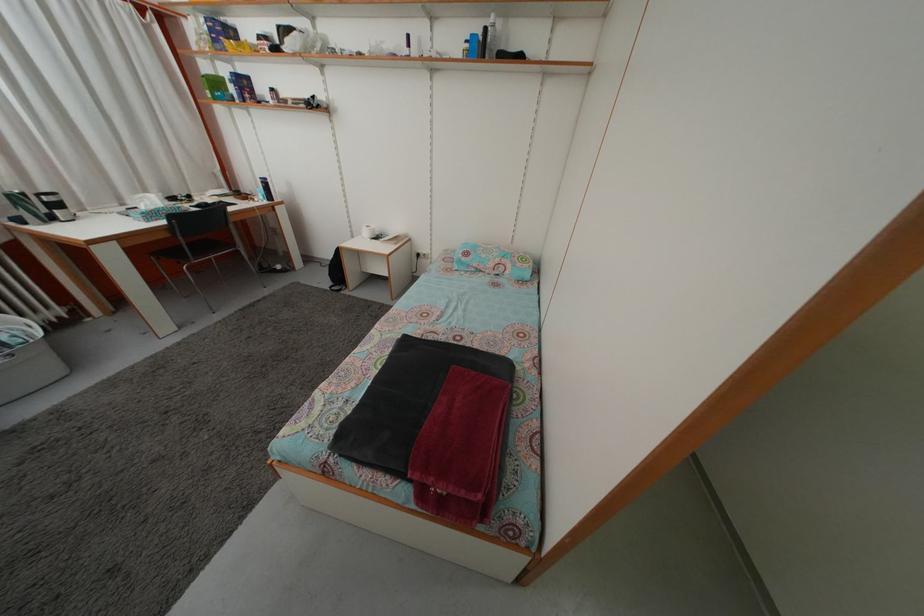
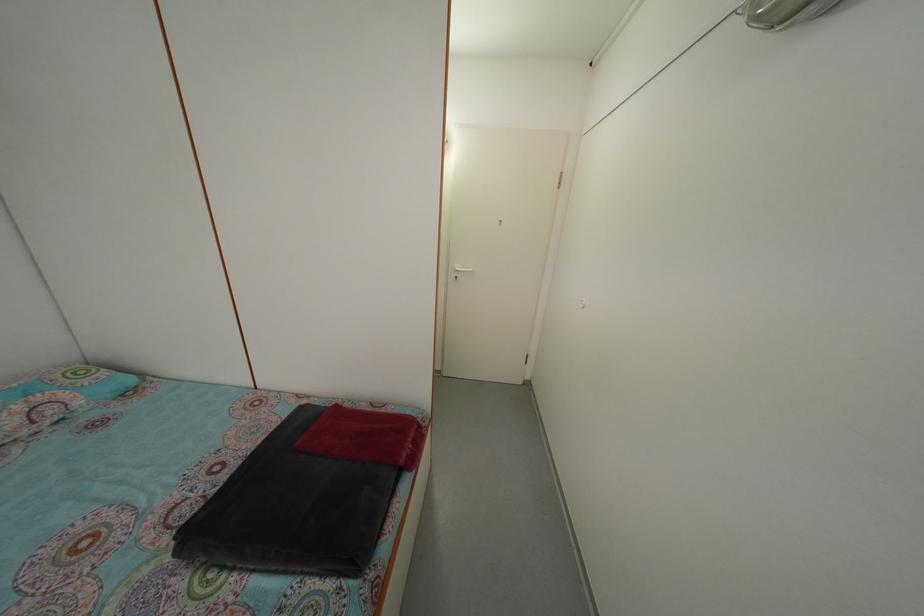
Looking at this image, the first image is from the beginning of the video and the second image is from the end. How did the camera likely rotate when shooting the video?

The camera's rotation is toward right-down.